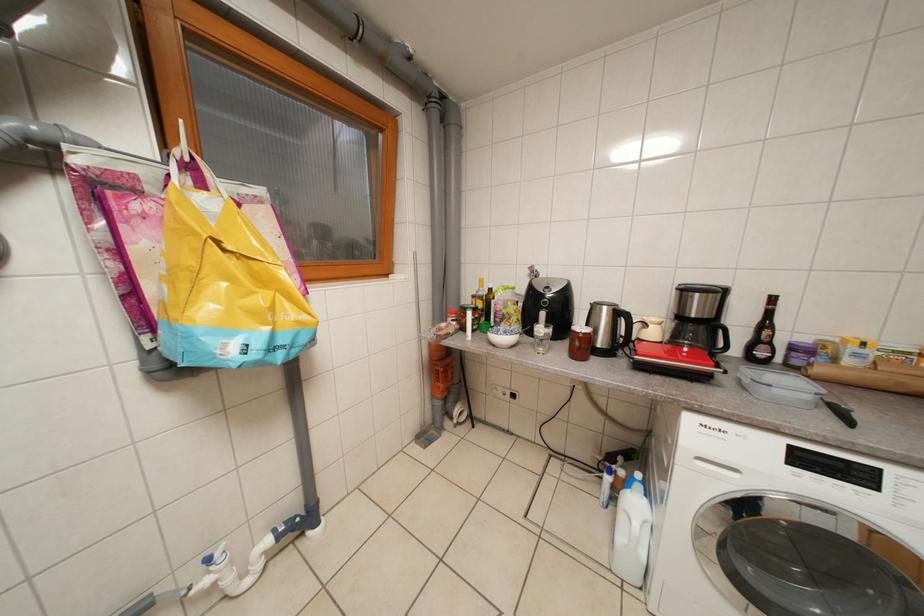
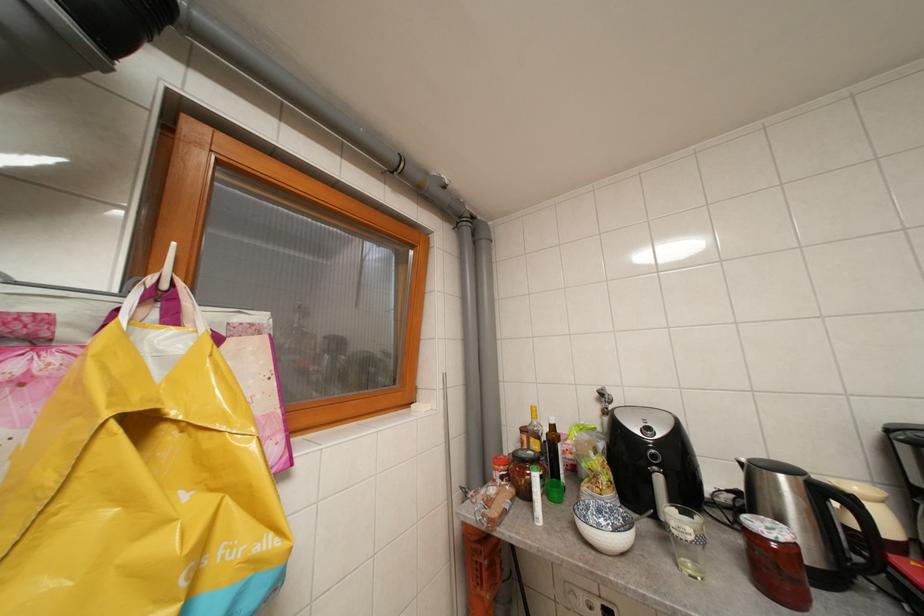
Question: How did the camera likely rotate?

Choices:
 (A) Left
 (B) Right
 (C) Up
 (D) Down

Answer: (C)